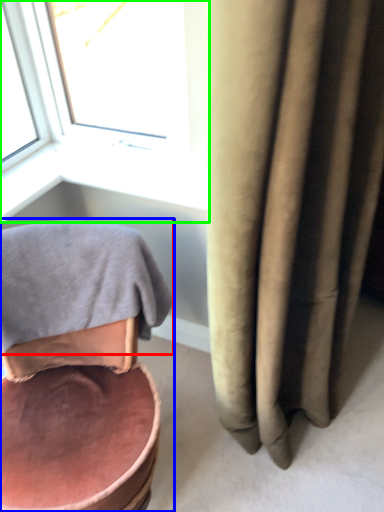
Question: Which is farther away from bath towel (highlighted by a red box)? chair (highlighted by a blue box) or window (highlighted by a green box)?

Choices:
 (A) chair
 (B) window

Answer: (B)